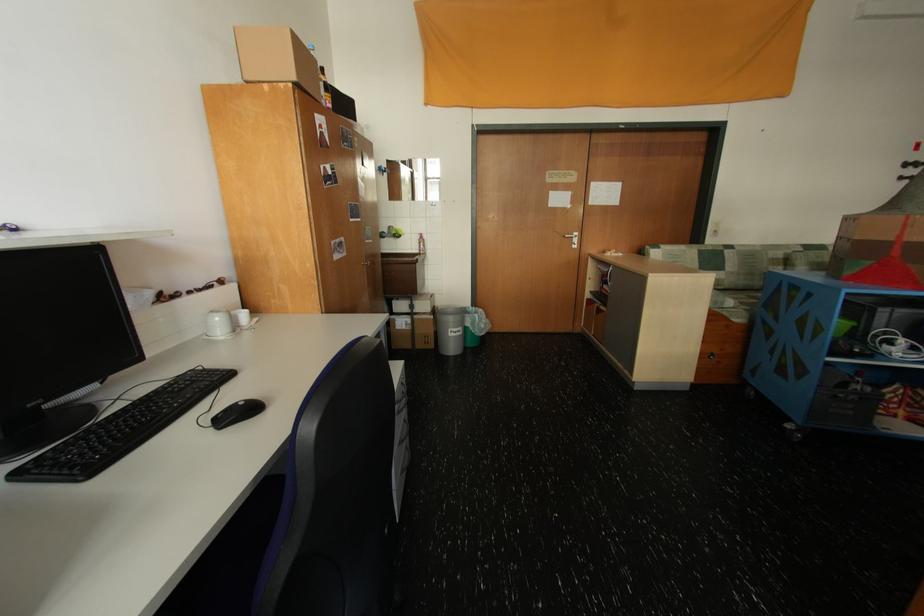
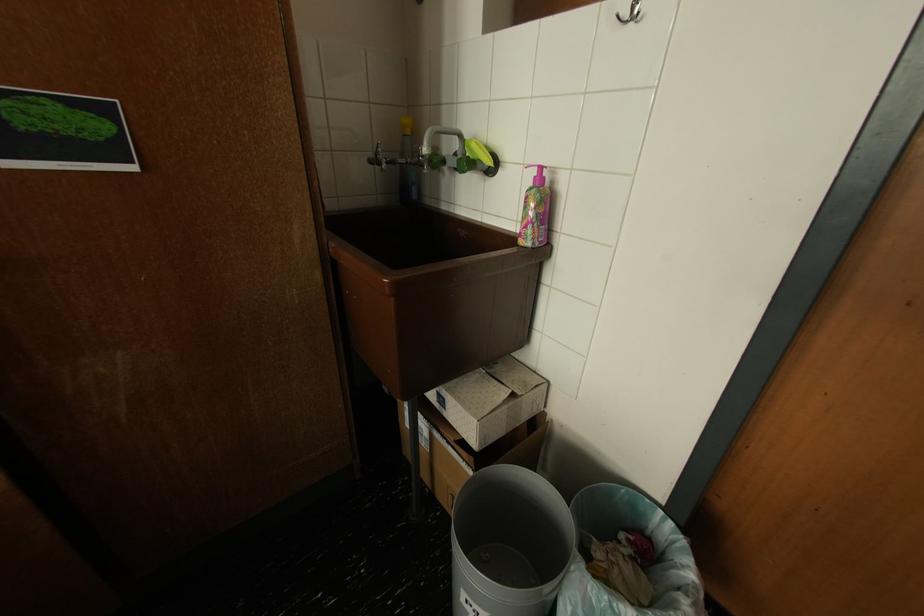
Where in the second image is the point corresponding to (439,297) from the first image?

(508, 402)